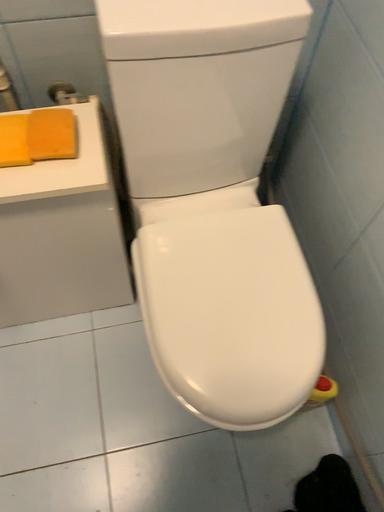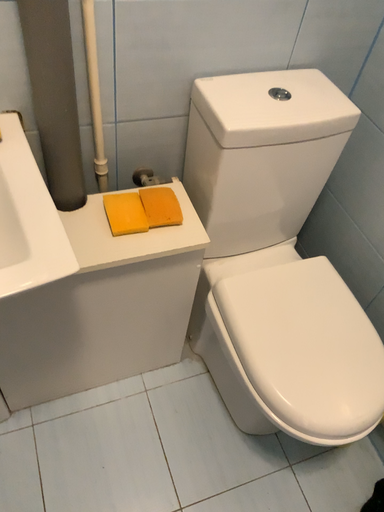
Question: How did the camera likely rotate when shooting the video?

Choices:
 (A) rotated downward
 (B) rotated upward

Answer: (B)